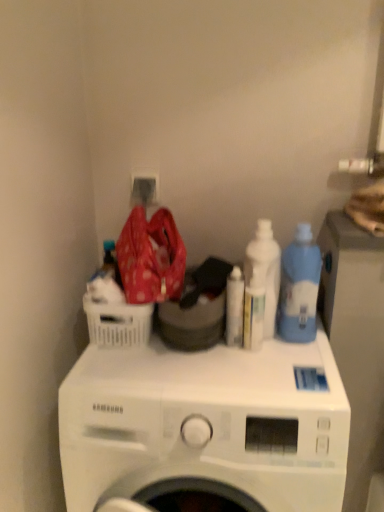
This screenshot has width=384, height=512. What do you see at coordinates (254, 312) in the screenshot?
I see `white plastic bottle at center` at bounding box center [254, 312].

In order to face white plastic basket at left, should I rotate leftwards or rightwards?

A 10.231 degree turn to the left will do.

Measure the distance between white glossy bottle at upper right, positioned as the second cleaning product in left-to-right order, and camera.

The distance of white glossy bottle at upper right, positioned as the second cleaning product in left-to-right order, from camera is 39.01 inches.

How much space does white glossy bottle at center, the 1th cleaning product when ordered from left to right, occupy horizontally?

white glossy bottle at center, the 1th cleaning product when ordered from left to right, is 1.78 inches in width.

Find the location of a particular element. blue translucent bottle at right, placed as the third cleaning product when sorted from left to right is located at coordinates (299, 288).

Which of these two, blue translucent bottle at right, placed as the third cleaning product when sorted from left to right, or white plastic bottle at center, is bigger?

blue translucent bottle at right, placed as the third cleaning product when sorted from left to right.

Does blue translucent bottle at right, placed as the third cleaning product when sorted from left to right, come in front of white plastic bottle at center?

Yes.

Does point (299, 337) appear closer or farther from the camera than point (252, 282)?

Point (299, 337) appears to be farther away from the viewer than point (252, 282).

Measure the distance between white plastic bottle at center and white glossy bottle at upper right, which appears as the second cleaning product when viewed from the right.

white plastic bottle at center and white glossy bottle at upper right, which appears as the second cleaning product when viewed from the right, are 2.09 inches apart.

From the image's perspective, relative to white glossy bottle at upper right, which appears as the second cleaning product when viewed from the right, is white plastic bottle at center above or below?

Clearly, from the image's perspective, white plastic bottle at center is below white glossy bottle at upper right, which appears as the second cleaning product when viewed from the right.

From a real-world perspective, which is physically below, white plastic bottle at center or white glossy bottle at upper right, positioned as the second cleaning product in left-to-right order?

white plastic bottle at center is physically lower.

At what (x,y) coordinates should I click in order to perform the action: click on the 1st cleaning product to the right of the white plastic bottle at center, starting your count from the anchor. Please return your answer as a coordinate pair (x, y). This screenshot has width=384, height=512. Looking at the image, I should click on (264, 271).

Considering the relative sizes of white glossy bottle at upper right, positioned as the second cleaning product in left-to-right order, and blue translucent bottle at right, placed as the first cleaning product when sorted from right to left, in the image provided, is white glossy bottle at upper right, positioned as the second cleaning product in left-to-right order, bigger than blue translucent bottle at right, placed as the first cleaning product when sorted from right to left,?

Actually, white glossy bottle at upper right, positioned as the second cleaning product in left-to-right order, might be smaller than blue translucent bottle at right, placed as the first cleaning product when sorted from right to left.

From a real-world perspective, relative to blue translucent bottle at right, placed as the first cleaning product when sorted from right to left, is white glossy bottle at upper right, positioned as the second cleaning product in left-to-right order, vertically above or below?

white glossy bottle at upper right, positioned as the second cleaning product in left-to-right order, is below blue translucent bottle at right, placed as the first cleaning product when sorted from right to left.

This screenshot has width=384, height=512. I want to click on the 2nd cleaning product behind the blue translucent bottle at right, placed as the first cleaning product when sorted from right to left, counting from the anchor's position, so click(x=264, y=271).

How different are the orientations of white glossy bottle at upper right, which appears as the second cleaning product when viewed from the right, and blue translucent bottle at right, placed as the third cleaning product when sorted from left to right, in degrees?

They differ by 0.000428 degrees in their facing directions.

Can you confirm if white plastic basket at left is wider than white matte washing machine at center?

In fact, white plastic basket at left might be narrower than white matte washing machine at center.

Is white plastic basket at left bigger than white matte washing machine at center?

No.

In the image, there is a white plastic basket at left. Identify the location of washing machine below it (from the image's perspective). (206, 425).

From a real-world perspective, relative to white matte washing machine at center, is white plastic basket at left vertically above or below?

white plastic basket at left is above white matte washing machine at center.

Which object is further away from the camera taking this photo, white glossy bottle at center, which is the third cleaning product from right to left, or white plastic basket at left?

white glossy bottle at center, which is the third cleaning product from right to left, is further away from the camera.

Is point (227, 289) closer to camera compared to point (131, 327)?

No.

Is white glossy bottle at center, the 1th cleaning product when ordered from left to right, far away from white plastic basket at left?

No.

The image size is (384, 512). Identify the location of basket that is on the left side of white glossy bottle at upper right, positioned as the second cleaning product in left-to-right order. (117, 323).

From a real-world perspective, relative to white glossy bottle at upper right, positioned as the second cleaning product in left-to-right order, is white plastic basket at left vertically above or below?

white plastic basket at left is situated lower than white glossy bottle at upper right, positioned as the second cleaning product in left-to-right order, in the real world.

Between point (111, 332) and point (262, 257), which one is positioned in front?

The point (262, 257) is closer.

In the scene shown: Is white plastic basket at left looking in the opposite direction of white glossy bottle at upper right, positioned as the second cleaning product in left-to-right order?

white plastic basket at left does not have its back to white glossy bottle at upper right, positioned as the second cleaning product in left-to-right order.

Is point (246, 261) closer or farther from the camera than point (204, 434)?

Clearly, point (246, 261) is more distant from the camera than point (204, 434).

Which object is closer to the camera taking this photo, white glossy bottle at upper right, positioned as the second cleaning product in left-to-right order, or white matte washing machine at center?

white matte washing machine at center is more forward.

Is white glossy bottle at upper right, which appears as the second cleaning product when viewed from the right, surrounding white matte washing machine at center?

No, white matte washing machine at center is not a part of white glossy bottle at upper right, which appears as the second cleaning product when viewed from the right.

Locate an element on the screen. The height and width of the screenshot is (512, 384). bottle behind the blue translucent bottle at right, placed as the first cleaning product when sorted from right to left is located at coordinates (254, 312).

The width and height of the screenshot is (384, 512). Identify the location of bottle below the white glossy bottle at upper right, which appears as the second cleaning product when viewed from the right (from a real-world perspective). (254, 312).

From the image, which object appears to be farther from white glossy bottle at center, the 1th cleaning product when ordered from left to right, white matte washing machine at center or white plastic bottle at center?

The object further to white glossy bottle at center, the 1th cleaning product when ordered from left to right, is white matte washing machine at center.

Looking at the image, which one is located further to white plastic basket at left, white plastic bottle at center or white glossy bottle at upper right, which appears as the second cleaning product when viewed from the right?

Among the two, white glossy bottle at upper right, which appears as the second cleaning product when viewed from the right, is located further to white plastic basket at left.

From the image, which object appears to be farther from white glossy bottle at upper right, which appears as the second cleaning product when viewed from the right, white matte washing machine at center or white glossy bottle at center, the 1th cleaning product when ordered from left to right?

Based on the image, white matte washing machine at center appears to be further to white glossy bottle at upper right, which appears as the second cleaning product when viewed from the right.

Estimate the real-world distances between objects in this image. Which object is closer to white glossy bottle at center, the 1th cleaning product when ordered from left to right, blue translucent bottle at right, placed as the third cleaning product when sorted from left to right, or white matte washing machine at center?

blue translucent bottle at right, placed as the third cleaning product when sorted from left to right, is closer to white glossy bottle at center, the 1th cleaning product when ordered from left to right.

Considering their positions, is white plastic bottle at center positioned closer to white matte washing machine at center than white glossy bottle at center, which is the third cleaning product from right to left?

white glossy bottle at center, which is the third cleaning product from right to left, is closer to white matte washing machine at center.

When comparing their distances from blue translucent bottle at right, placed as the third cleaning product when sorted from left to right, does white matte washing machine at center or white plastic bottle at center seem further?

Based on the image, white matte washing machine at center appears to be further to blue translucent bottle at right, placed as the third cleaning product when sorted from left to right.

Estimate the real-world distances between objects in this image. Which object is further from white glossy bottle at upper right, which appears as the second cleaning product when viewed from the right, blue translucent bottle at right, placed as the first cleaning product when sorted from right to left, or white plastic bottle at center?

blue translucent bottle at right, placed as the first cleaning product when sorted from right to left, is further to white glossy bottle at upper right, which appears as the second cleaning product when viewed from the right.

When comparing their distances from white glossy bottle at center, which is the third cleaning product from right to left, does blue translucent bottle at right, placed as the first cleaning product when sorted from right to left, or white plastic basket at left seem closer?

blue translucent bottle at right, placed as the first cleaning product when sorted from right to left, is positioned closer to the anchor white glossy bottle at center, which is the third cleaning product from right to left.

Locate an element on the screen. bottle between blue translucent bottle at right, placed as the first cleaning product when sorted from right to left, and white matte washing machine at center from top to bottom is located at coordinates (254, 312).

I want to click on basket between white glossy bottle at upper right, positioned as the second cleaning product in left-to-right order, and white matte washing machine at center vertically, so click(117, 323).

You are a GUI agent. You are given a task and a screenshot of the screen. Output one action in this format:
    pyautogui.click(x=<x>, y=<y>)
    Task: Click on the cleaning product between white glossy bottle at center, which is the third cleaning product from right to left, and blue translucent bottle at right, placed as the first cleaning product when sorted from right to left, from left to right
    
    Given the screenshot: What is the action you would take?
    pyautogui.click(x=264, y=271)

Where is `cleaning product between white plastic basket at left and white matte washing machine at center in the up-down direction`? The image size is (384, 512). cleaning product between white plastic basket at left and white matte washing machine at center in the up-down direction is located at coordinates (234, 307).